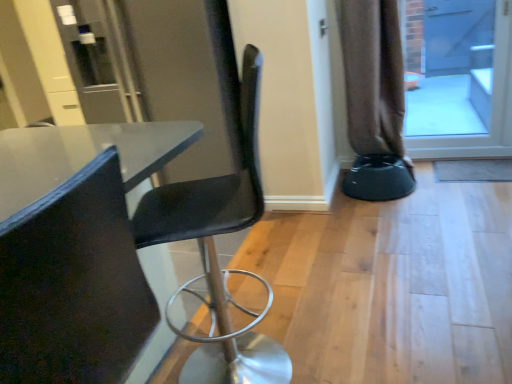
Locate an element on the screen. The width and height of the screenshot is (512, 384). vacant area that lies between matte black chair at center, arranged as the first chair when viewed from the back, and black plastic bar stool at lower right is located at coordinates (329, 263).